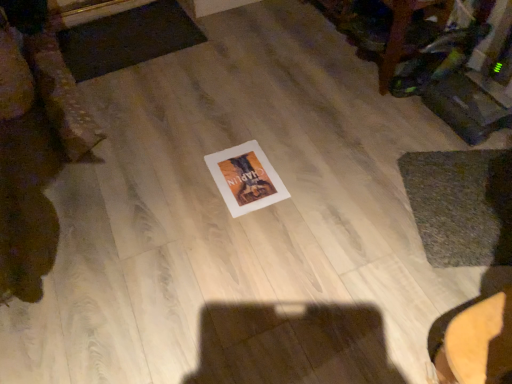
This screenshot has width=512, height=384. Find the location of `empty space that is ontop of white paper at center`. empty space that is ontop of white paper at center is located at coordinates (246, 174).